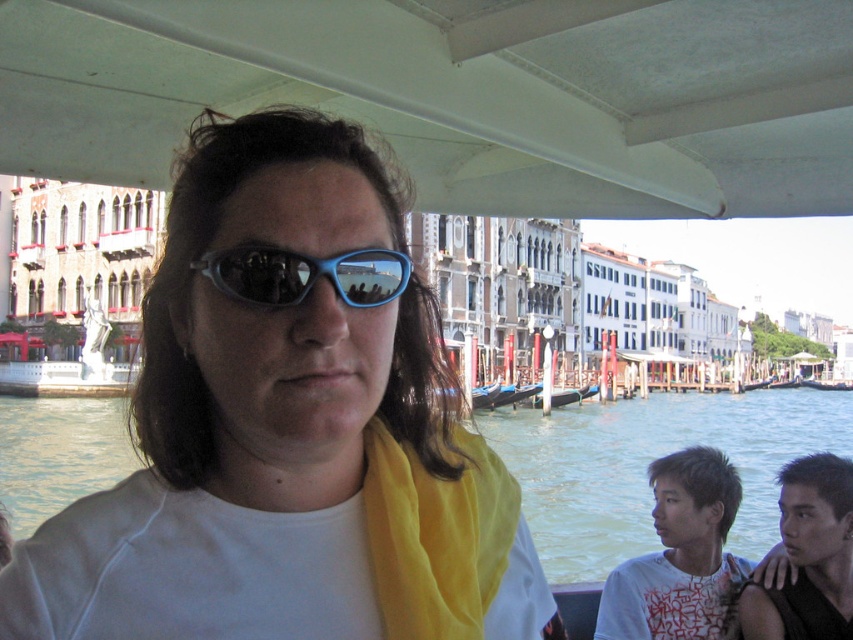
You are a photographer trying to capture a closeup shot of both the white matte sunglasses at center and the blue plastic goggles at center in the scene. Given that your camera has a maximum focus range of 5 meters, can you fit both items in the same frame without moving closer?

The white matte sunglasses at center and blue plastic goggles at center are 7.61 meters apart from each other. Since the distance between them exceeds the camera maximum focus range of 5 meters, you cannot fit both items in the same frame without moving closer.

You are a photographer standing on a gondola in Venice. You want to take a photo of the person in the scene. The camera you are using has a maximum focus range of 80 feet. Can you capture both the white matte sunglasses at center and the smooth black hair at lower right in focus at the same time?

The white matte sunglasses at center and smooth black hair at lower right are 86.93 feet apart from each other, which exceeds the camera maximum focus range of 80 feet. Therefore, you cannot capture both in focus simultaneously.

From the picture: You are a photographer trying to capture the perfect shot of the white matte sunglasses at center. The camera you are using has a focal length of 50mm. To ensure the sunglasses are in focus, you need to know their exact position. According to the coordinates provided, where are the white matte sunglasses located in the image?

The white matte sunglasses at center are located at coordinates point (254, 404).